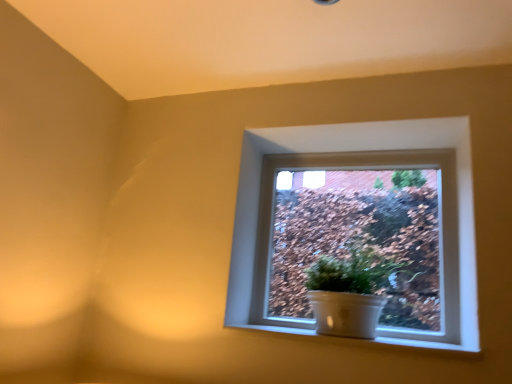
Question: Considering the relative sizes of white ceramic at lower center and white ceramic pot at center in the image provided, is white ceramic at lower center thinner than white ceramic pot at center?

Choices:
 (A) yes
 (B) no

Answer: (A)

Question: Can you confirm if white ceramic at lower center is positioned to the right of white ceramic pot at center?

Choices:
 (A) yes
 (B) no

Answer: (B)

Question: Is the surface of white ceramic at lower center in direct contact with white ceramic pot at center?

Choices:
 (A) no
 (B) yes

Answer: (A)

Question: Is white ceramic at lower center located outside white ceramic pot at center?

Choices:
 (A) yes
 (B) no

Answer: (A)

Question: Does white ceramic at lower center have a smaller size compared to white ceramic pot at center?

Choices:
 (A) yes
 (B) no

Answer: (A)

Question: From the image's perspective, is white ceramic at lower center located above or below white ceramic pot at center?

Choices:
 (A) below
 (B) above

Answer: (A)

Question: In terms of size, does white ceramic at lower center appear bigger or smaller than white ceramic pot at center?

Choices:
 (A) small
 (B) big

Answer: (A)

Question: In terms of width, does white ceramic at lower center look wider or thinner when compared to white ceramic pot at center?

Choices:
 (A) wide
 (B) thin

Answer: (B)

Question: Is white ceramic at lower center to the left or to the right of white ceramic pot at center in the image?

Choices:
 (A) right
 (B) left

Answer: (B)

Question: Considering the positions of white ceramic at lower center and white glossy pot at center in the image, is white ceramic at lower center taller or shorter than white glossy pot at center?

Choices:
 (A) tall
 (B) short

Answer: (B)

Question: Is point (390, 337) closer or farther from the camera than point (271, 243)?

Choices:
 (A) closer
 (B) farther

Answer: (A)

Question: Which is correct: white ceramic at lower center is inside white glossy pot at center, or outside of it?

Choices:
 (A) outside
 (B) inside

Answer: (A)

Question: Would you say white ceramic at lower center is to the left or to the right of white glossy pot at center in the picture?

Choices:
 (A) right
 (B) left

Answer: (B)

Question: Considering the positions of white ceramic pot at center and white glossy pot at center in the image, is white ceramic pot at center taller or shorter than white glossy pot at center?

Choices:
 (A) tall
 (B) short

Answer: (B)

Question: Is white ceramic pot at center inside the boundaries of white glossy pot at center, or outside?

Choices:
 (A) inside
 (B) outside

Answer: (B)